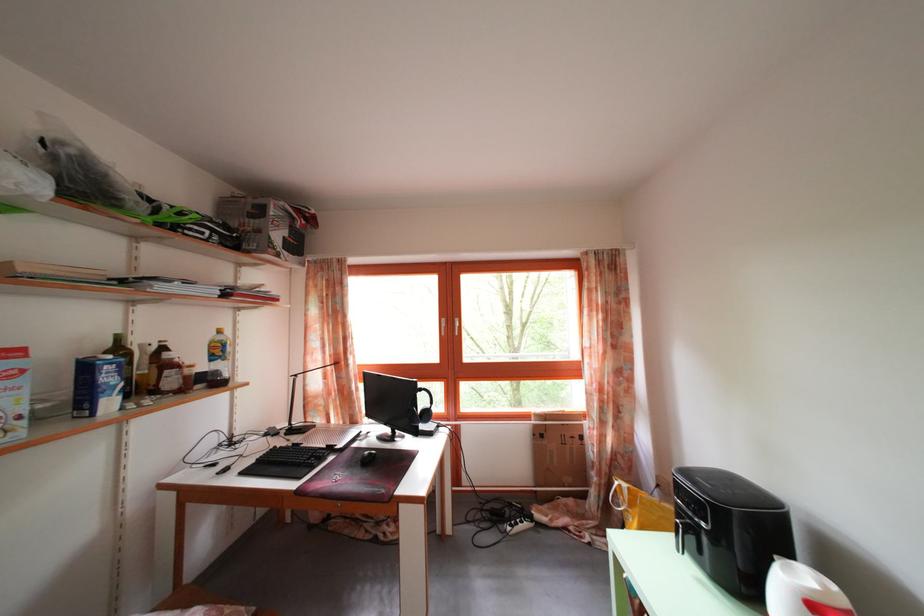
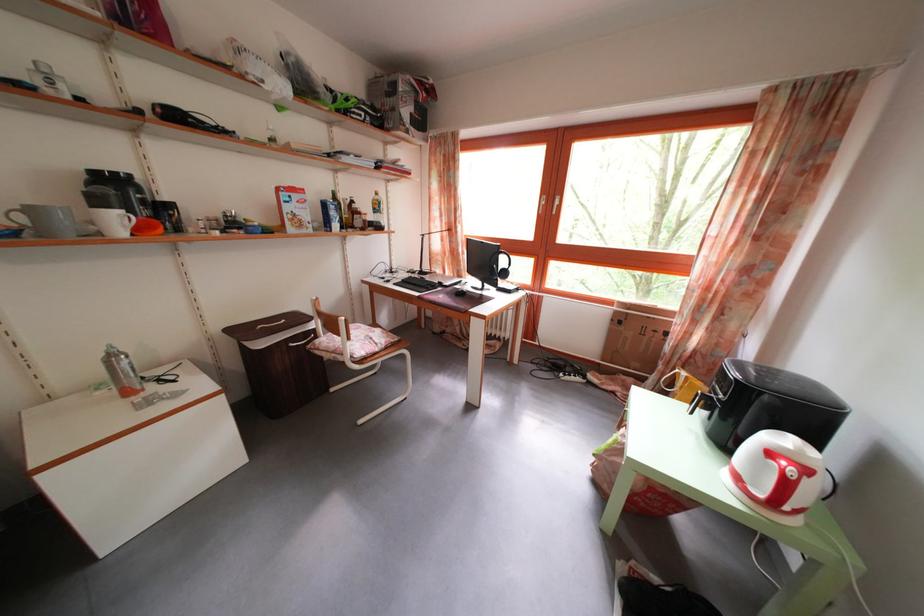
Find the pixel in the second image that matches point 542,432 in the first image.

(623, 320)